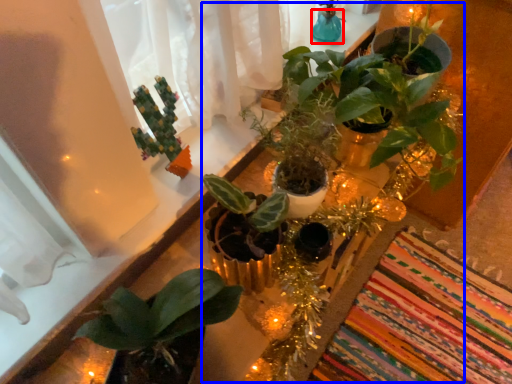
Question: Among these objects, which one is nearest to the camera, glass vase (highlighted by a red box) or floral arrangement (highlighted by a blue box)?

Choices:
 (A) glass vase
 (B) floral arrangement

Answer: (B)